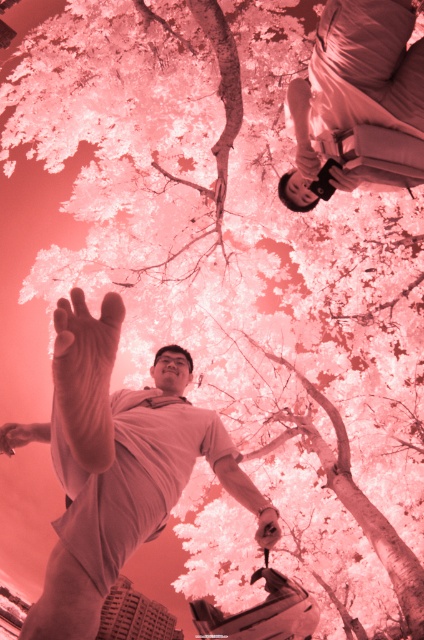
Where is the white cotton shirt at center located in the image?

The white cotton shirt at center is located at point (113,468).

You are a photographer trying to capture the scene with your matte black camera at upper center. The subject is wearing a white cotton shirt at center. If the shirt appears larger in the photo than the camera, does this mean the subject is closer to you than the camera?

Yes, because the white cotton shirt at center is bigger than the matte black camera at upper center in the image, which indicates that the subject wearing the white cotton shirt at center is closer to the photographer than the matte black camera at upper center.

You are standing in the surreal pinkish scene and want to move from the point at coordinates point (109,320) to the point at coordinates point (396,106). Which direction should you face to walk towards the second point?

To move from point (109,320) to point (396,106), you should face upwards and to the left since point (396,106) is located in that direction relative to point (109,320).